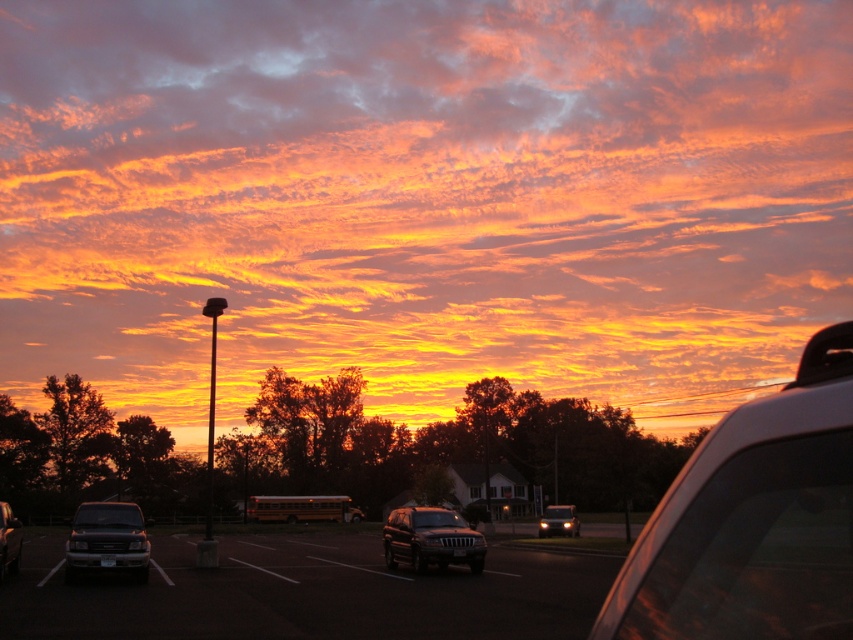
Question: Which of the following is the closest to the observer?

Choices:
 (A) (537, 188)
 (B) (114, 534)
 (C) (425, 528)

Answer: (B)

Question: Which of these objects is positioned closest to the satin black suv at center?

Choices:
 (A) white glossy car at right
 (B) metallic silver suv at lower left
 (C) metallic silver suv at center
 (D) matte black suv at center

Answer: (C)

Question: Which of the following is the farthest from the observer?

Choices:
 (A) (782, 618)
 (B) (68, 573)

Answer: (B)

Question: Where is metallic silver suv at center located in relation to matte black suv at center in the image?

Choices:
 (A) below
 (B) above

Answer: (B)

Question: Can you confirm if satin black suv at center is positioned to the left of matte black suv at center?

Choices:
 (A) no
 (B) yes

Answer: (B)

Question: Can you confirm if matte black suv at lower left is positioned to the left of matte black suv at center?

Choices:
 (A) no
 (B) yes

Answer: (B)